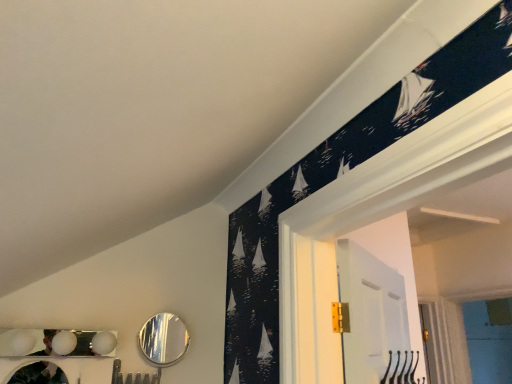
Question: Considering their positions, is metallic silver mirror at lower left, marked as the 2th mirror in a right-to-left arrangement, located in front of or behind shiny silver mirror at lower center, positioned as the 1th mirror in back-to-front order?

Choices:
 (A) front
 (B) behind

Answer: (A)

Question: Is metallic silver mirror at lower left, acting as the 1th mirror starting from the front, inside the boundaries of shiny silver mirror at lower center, the second mirror in the left-to-right sequence, or outside?

Choices:
 (A) inside
 (B) outside

Answer: (B)

Question: Considering the positions of metallic silver mirror at lower left, marked as the 2th mirror in a right-to-left arrangement, and shiny silver mirror at lower center, the second mirror in the left-to-right sequence, in the image, is metallic silver mirror at lower left, marked as the 2th mirror in a right-to-left arrangement, wider or thinner than shiny silver mirror at lower center, the second mirror in the left-to-right sequence,?

Choices:
 (A) thin
 (B) wide

Answer: (B)

Question: Does point (156, 342) appear closer or farther from the camera than point (34, 367)?

Choices:
 (A) farther
 (B) closer

Answer: (A)

Question: From a real-world perspective, is shiny silver mirror at lower center, the second mirror in the left-to-right sequence, positioned above or below metallic silver mirror at lower left, marked as the 2th mirror in a right-to-left arrangement?

Choices:
 (A) below
 (B) above

Answer: (B)

Question: Considering the relative positions of shiny silver mirror at lower center, the second mirror in the left-to-right sequence, and metallic silver mirror at lower left, acting as the 1th mirror starting from the front, in the image provided, is shiny silver mirror at lower center, the second mirror in the left-to-right sequence, to the left or to the right of metallic silver mirror at lower left, acting as the 1th mirror starting from the front,?

Choices:
 (A) left
 (B) right

Answer: (B)

Question: Is shiny silver mirror at lower center, arranged as the second mirror when viewed from the front, spatially inside metallic silver mirror at lower left, which appears as the 1th mirror when viewed from the left, or outside of it?

Choices:
 (A) outside
 (B) inside

Answer: (A)